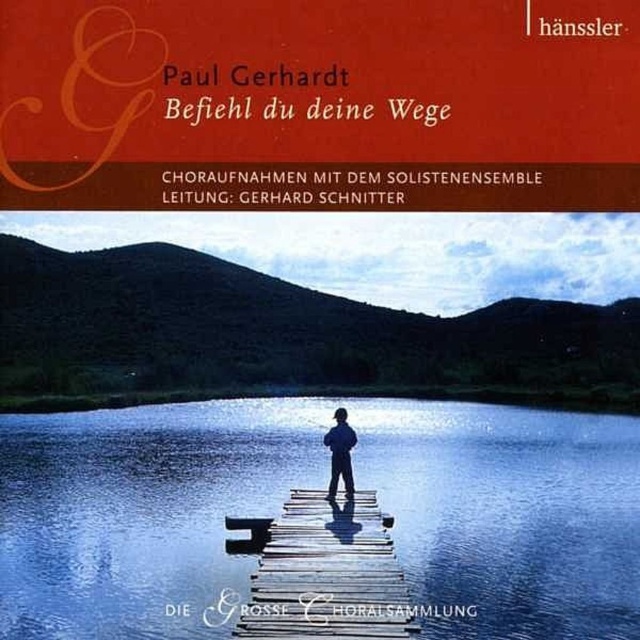
You are examining the album cover and notice the matte orange book cover at upper center and the blue fabric person at center. Which object is positioned closer to you?

The matte orange book cover at upper center is closer to the viewer than the blue fabric person at center.

What are the coordinates of the matte orange book cover at upper center on the image?

The coordinates of the matte orange book cover at upper center are at point [320,104].

You are designing a poster and need to know the relative sizes of the objects. Which object is taller between the matte orange book cover at upper center and the blue fabric person at center?

The matte orange book cover at upper center is much taller than the blue fabric person at center.